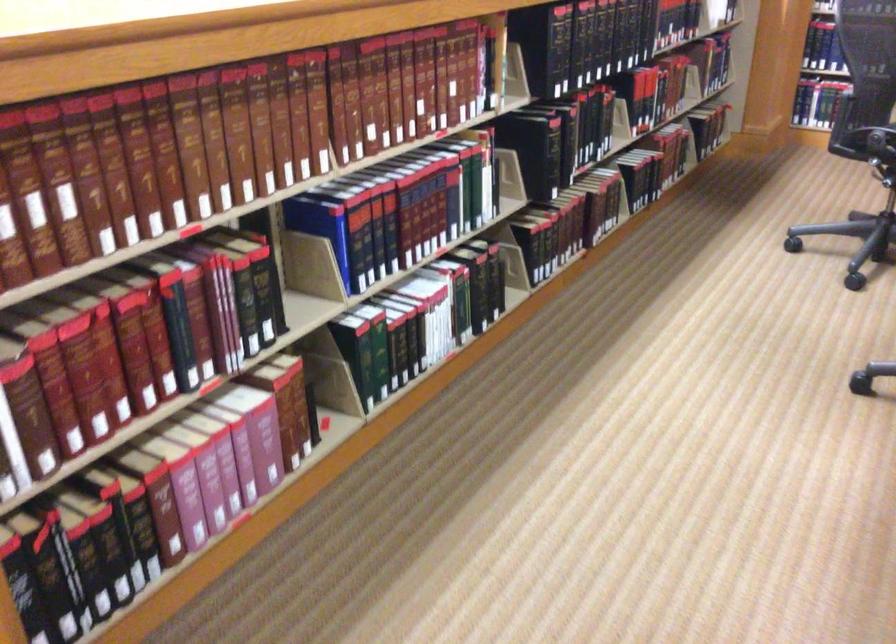
Find the location of a particular element. This screenshot has height=644, width=896. black chair armrest is located at coordinates (874, 143).